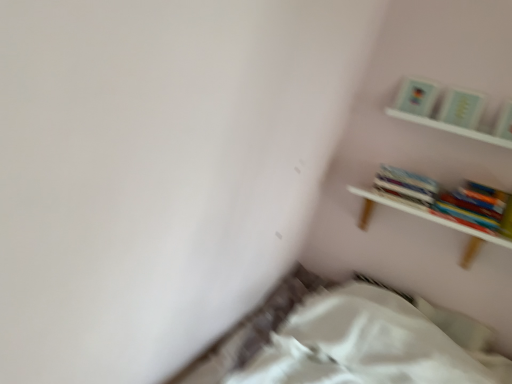
Question: Is the depth of white wooden shelf at upper right, the 2th shelf positioned from the top, less than that of hardcover books at upper right?

Choices:
 (A) yes
 (B) no

Answer: (A)

Question: Is white wooden shelf at upper right, the 2th shelf positioned from the top, at the left side of hardcover books at upper right?

Choices:
 (A) yes
 (B) no

Answer: (B)

Question: Is white wooden shelf at upper right, the 2th shelf positioned from the top, turned away from hardcover books at upper right?

Choices:
 (A) yes
 (B) no

Answer: (B)

Question: Does white wooden shelf at upper right, the 2th shelf positioned from the top, turn towards hardcover books at upper right?

Choices:
 (A) no
 (B) yes

Answer: (A)

Question: From a real-world perspective, is white wooden shelf at upper right, the 2th shelf positioned from the top, over hardcover books at upper right?

Choices:
 (A) yes
 (B) no

Answer: (B)

Question: Considering the positions of point click(457, 120) and point click(436, 377), is point click(457, 120) closer or farther from the camera than point click(436, 377)?

Choices:
 (A) farther
 (B) closer

Answer: (A)

Question: In terms of size, does matte paper at upper right, which is the second paperback book from left to right, appear bigger or smaller than white fabric bed at lower center?

Choices:
 (A) small
 (B) big

Answer: (A)

Question: From a real-world perspective, is matte paper at upper right, which is the second paperback book from left to right, positioned above or below white fabric bed at lower center?

Choices:
 (A) above
 (B) below

Answer: (A)

Question: In the image, is matte paper at upper right, which is the second paperback book from left to right, positioned in front of or behind white fabric bed at lower center?

Choices:
 (A) behind
 (B) front

Answer: (A)

Question: Considering their positions, is hardcover book at upper right, the 1th paperback book from the right, located in front of or behind matte paper at upper right, positioned as the 3th paperback book in right-to-left order?

Choices:
 (A) behind
 (B) front

Answer: (B)

Question: Does point (493, 130) appear closer or farther from the camera than point (432, 86)?

Choices:
 (A) closer
 (B) farther

Answer: (A)

Question: Considering the positions of hardcover book at upper right, the 1th paperback book from the right, and matte paper at upper right, acting as the first paperback book starting from the left, in the image, is hardcover book at upper right, the 1th paperback book from the right, wider or thinner than matte paper at upper right, acting as the first paperback book starting from the left,?

Choices:
 (A) wide
 (B) thin

Answer: (B)

Question: From a real-world perspective, is hardcover book at upper right, the 1th paperback book from the right, physically located above or below matte paper at upper right, positioned as the 3th paperback book in right-to-left order?

Choices:
 (A) below
 (B) above

Answer: (A)

Question: Considering the positions of matte paper at upper right, acting as the first paperback book starting from the left, and hardcover books at upper right in the image, is matte paper at upper right, acting as the first paperback book starting from the left, taller or shorter than hardcover books at upper right?

Choices:
 (A) tall
 (B) short

Answer: (A)

Question: Considering their positions, is matte paper at upper right, positioned as the 3th paperback book in right-to-left order, located in front of or behind hardcover books at upper right?

Choices:
 (A) front
 (B) behind

Answer: (B)